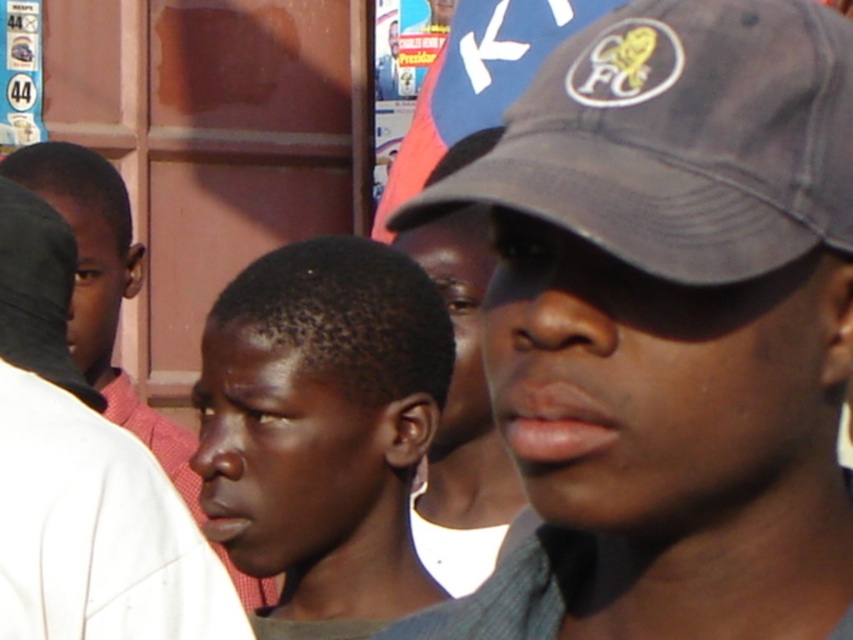
Who is more forward, [549,497] or [221,497]?

Point [549,497]

Is point (759, 632) farther from viewer compared to point (392, 548)?

No, it is not.

In order to click on dark gray cap at center in this screenshot , I will do `click(670, 328)`.

Can you confirm if dark gray cap at center is shorter than smooth skin face at center?

Indeed, dark gray cap at center has a lesser height compared to smooth skin face at center.

Who is taller, dark gray cap at center or smooth skin face at center?

Standing taller between the two is smooth skin face at center.

Image resolution: width=853 pixels, height=640 pixels. Describe the element at coordinates (670, 328) in the screenshot. I see `dark gray cap at center` at that location.

You are a GUI agent. You are given a task and a screenshot of the screen. Output one action in this format:
    pyautogui.click(x=<x>, y=<y>)
    Task: Click on the dark gray cap at center
    
    Given the screenshot: What is the action you would take?
    pyautogui.click(x=670, y=328)

Where is `dark gray cap at center`? Image resolution: width=853 pixels, height=640 pixels. dark gray cap at center is located at coordinates (670, 328).

Looking at this image, who is positioned more to the left, dark gray cap at center or matte black cap at upper right?

Positioned to the left is matte black cap at upper right.

Who is more distant from viewer, (579, 282) or (497, 131)?

Point (497, 131)

I want to click on dark gray cap at center, so click(x=670, y=328).